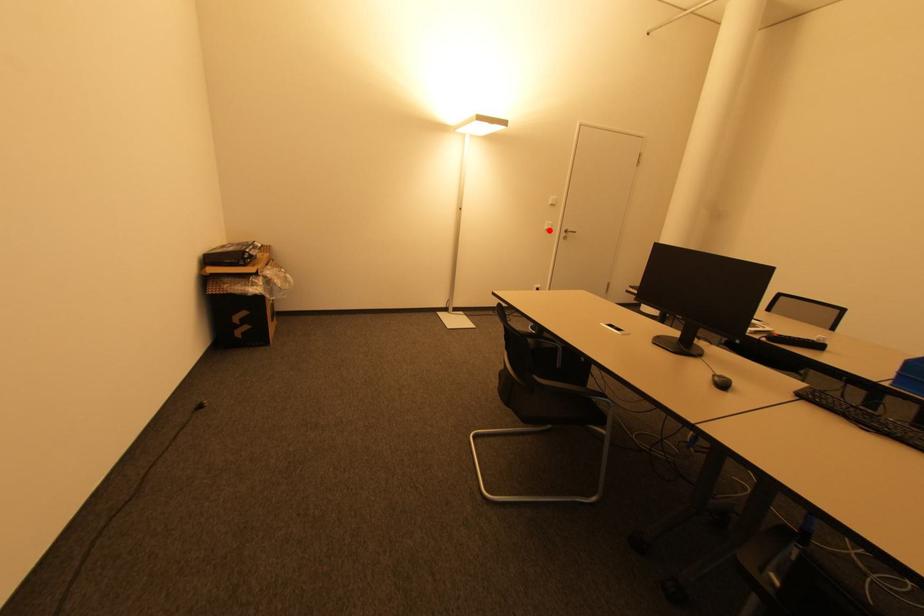
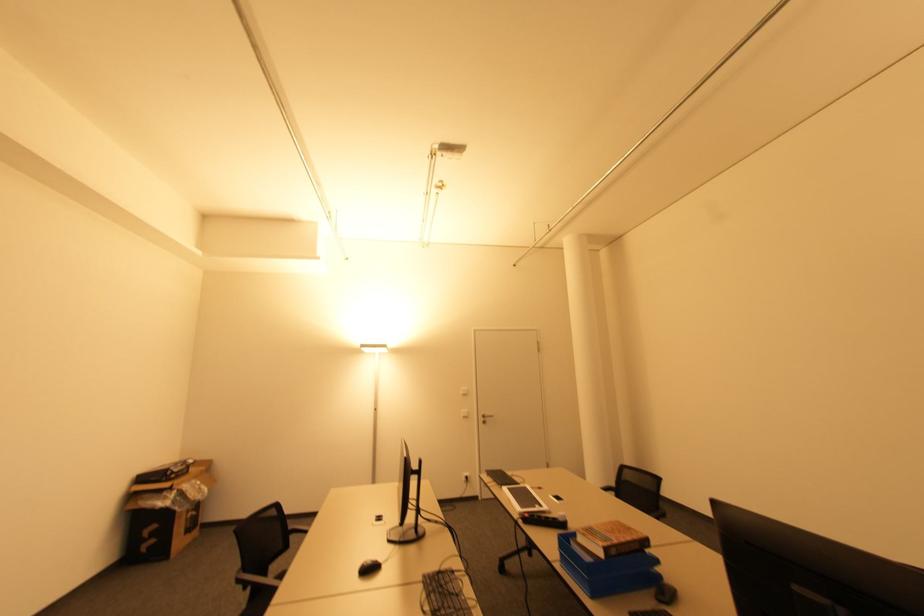
Question: I am providing you with two images of the same scene from different viewpoints. A red point is shown in image1. For the corresponding object point in image2, is it positioned nearer or farther from the camera?

Choices:
 (A) Nearer
 (B) Farther

Answer: (B)